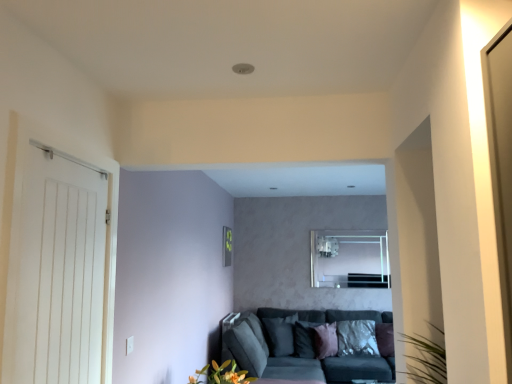
Question: Is silky purple pillow at lower center, the first pillow from the left, taller than white wooden door at left?

Choices:
 (A) yes
 (B) no

Answer: (B)

Question: From the image's perspective, is silky purple pillow at lower center, the first pillow from the left, under white wooden door at left?

Choices:
 (A) no
 (B) yes

Answer: (B)

Question: Is silky purple pillow at lower center, which appears as the 6th pillow when viewed from the right, facing away from white wooden door at left?

Choices:
 (A) yes
 (B) no

Answer: (B)

Question: Does silky purple pillow at lower center, which appears as the 6th pillow when viewed from the right, contain white wooden door at left?

Choices:
 (A) yes
 (B) no

Answer: (B)

Question: Is silky purple pillow at lower center, the first pillow from the left, not near white wooden door at left?

Choices:
 (A) yes
 (B) no

Answer: (A)

Question: Is silky purple pillow at lower center, which appears as the 6th pillow when viewed from the right, oriented towards white wooden door at left?

Choices:
 (A) no
 (B) yes

Answer: (A)

Question: Is silky purple pillow at center, acting as the fourth pillow starting from the right, facing towards pink velvet pillow at center, arranged as the fourth pillow when viewed from the left?

Choices:
 (A) no
 (B) yes

Answer: (A)

Question: Is there a large distance between silky purple pillow at center, arranged as the third pillow when viewed from the left, and pink velvet pillow at center, arranged as the fourth pillow when viewed from the left?

Choices:
 (A) no
 (B) yes

Answer: (A)

Question: Does silky purple pillow at center, arranged as the third pillow when viewed from the left, come in front of pink velvet pillow at center, arranged as the fourth pillow when viewed from the left?

Choices:
 (A) no
 (B) yes

Answer: (A)

Question: Is the position of silky purple pillow at center, acting as the fourth pillow starting from the right, more distant than that of pink velvet pillow at center, placed as the 3th pillow when sorted from right to left?

Choices:
 (A) no
 (B) yes

Answer: (B)

Question: Is pink velvet pillow at center, placed as the 3th pillow when sorted from right to left, at the back of silky purple pillow at center, acting as the fourth pillow starting from the right?

Choices:
 (A) yes
 (B) no

Answer: (B)

Question: Does silky purple pillow at center, arranged as the third pillow when viewed from the left, have a larger size compared to pink velvet pillow at center, arranged as the fourth pillow when viewed from the left?

Choices:
 (A) no
 (B) yes

Answer: (A)

Question: Is pink velvet pillow at center, arranged as the fourth pillow when viewed from the left, positioned far away from white wooden door at left?

Choices:
 (A) no
 (B) yes

Answer: (B)